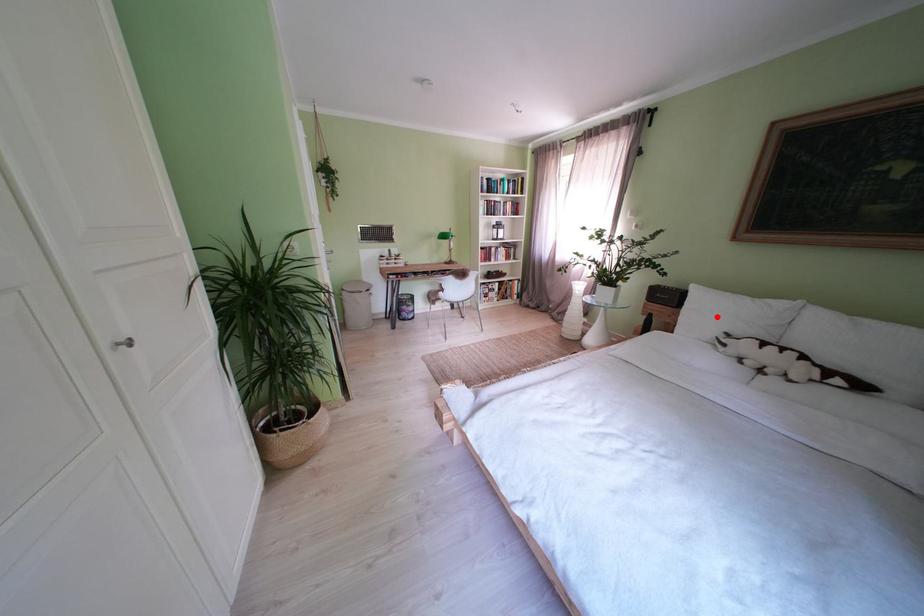
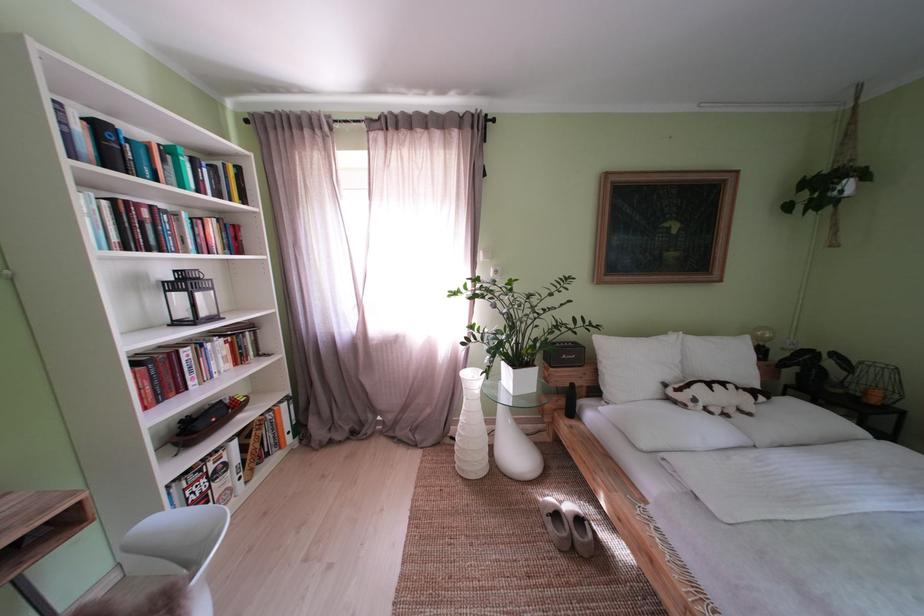
The point at the highlighted location is marked in the first image. Where is the corresponding point in the second image?

(639, 369)